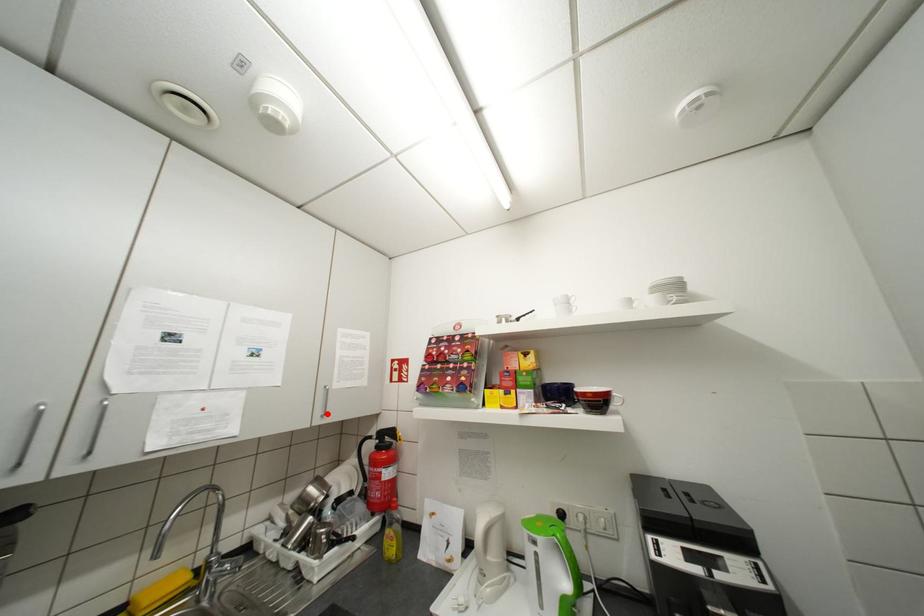
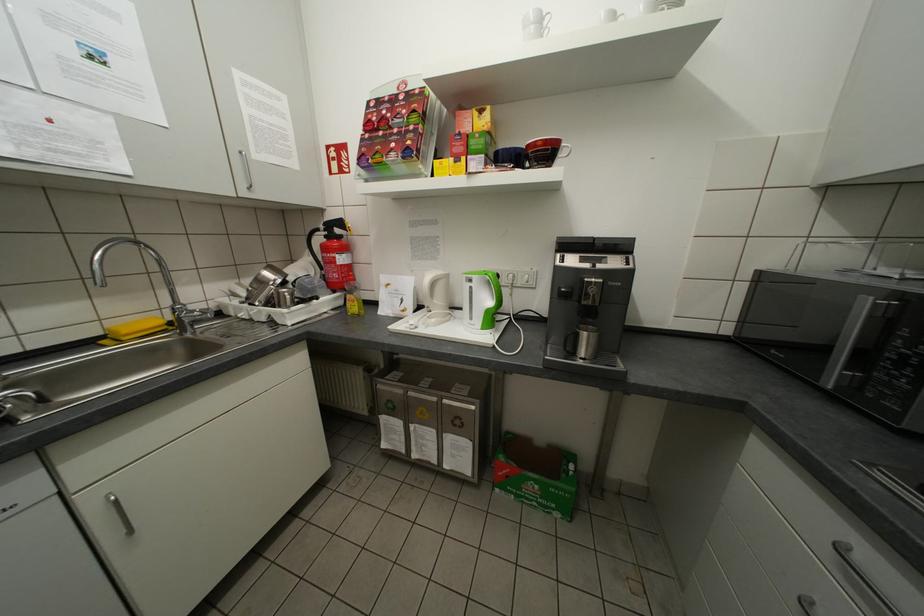
Find the pixel in the second image that matches the highlighted location in the first image.

(251, 185)